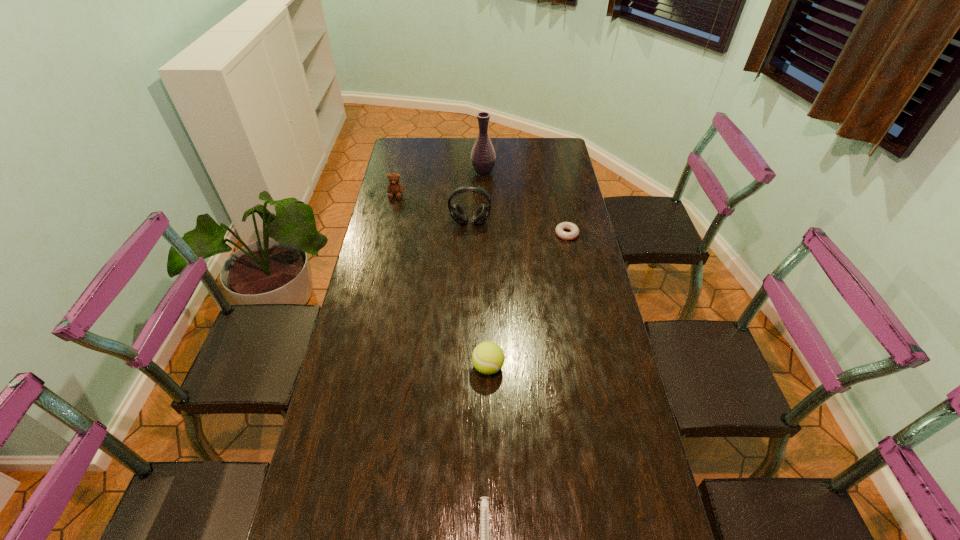
Locate an element on the screen. The height and width of the screenshot is (540, 960). empty location between the second nearest object and the leftmost object is located at coordinates (442, 281).

Identify the location of vacant area that lies between the fifth farthest object and the vase. (486, 270).

The image size is (960, 540). In order to click on free space between the fifth nearest object and the vase in this screenshot , I will do `click(440, 184)`.

At what (x,y) coordinates should I click in order to perform the action: click on free space between the teddy bear and the headset. Please return your answer as a coordinate pair (x, y). The height and width of the screenshot is (540, 960). Looking at the image, I should click on (433, 209).

In order to click on free space between the fifth shortest object and the second nearest object in this screenshot , I will do `click(479, 295)`.

Where is `unoccupied position between the second tallest object and the tallest object`? unoccupied position between the second tallest object and the tallest object is located at coordinates (476, 198).

This screenshot has width=960, height=540. I want to click on object that ranks as the third closest to the leftmost object, so click(x=574, y=233).

You are a GUI agent. You are given a task and a screenshot of the screen. Output one action in this format:
    pyautogui.click(x=<x>, y=<y>)
    Task: Click on the object that is the closest one to the doughnut
    This screenshot has width=960, height=540.
    Given the screenshot: What is the action you would take?
    pyautogui.click(x=457, y=213)

Identify the location of free location that satisfies the following two spatial constraints: 1. on the earcups of the headset; 2. on the right side of the tennis ball. The height and width of the screenshot is (540, 960). (467, 367).

This screenshot has height=540, width=960. Find the location of `vacant space that satisfies the following two spatial constraints: 1. on the face of the teddy bear; 2. on the right side of the rightmost object`. vacant space that satisfies the following two spatial constraints: 1. on the face of the teddy bear; 2. on the right side of the rightmost object is located at coordinates (387, 234).